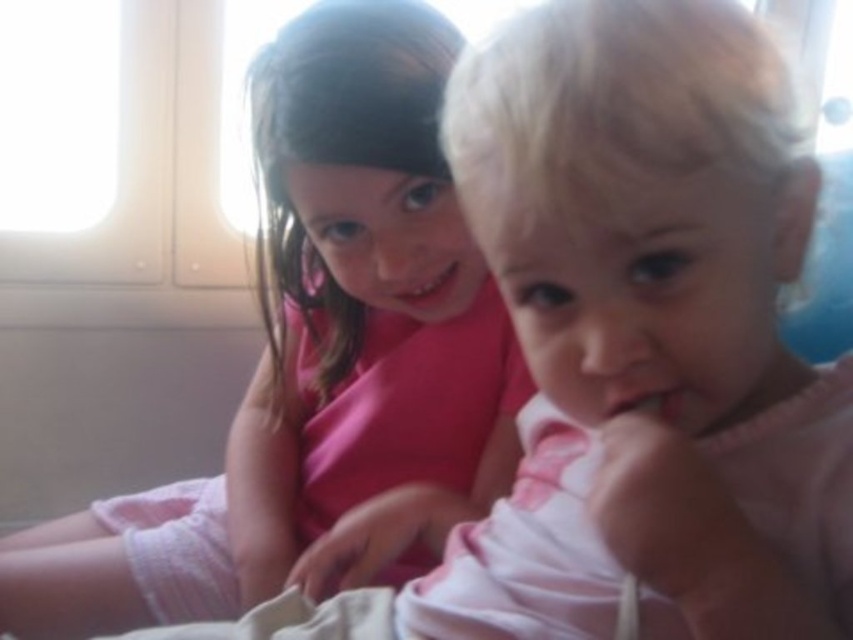
You are a photographer trying to capture a closeup of both children in the image. You have two points marked as reference points for focus. The first point is at coordinates point (x=369, y=26) and the second is at point (x=680, y=388). Which point should you focus on to ensure the child closer to you is in focus?

Point (x=369, y=26) is further to the viewer than point (x=680, y=388), so focusing on point (x=369, y=26) will ensure the child closer to you is in focus.

You are a photographer trying to capture the two children in the scene. You notice both have a matte pink mouth at center and a pink matte mouth at center. Which of the two mouths is directly above the other?

The matte pink mouth at center is positioned over the pink matte mouth at center, meaning it is directly above the latter.

You are a photographer trying to capture a closeup of the pink matte mouth at center without including the pink matte shirt at upper left in the frame. Based on their sizes, is this feasible?

The pink matte shirt at upper left might be wider than pink matte mouth at center, so there is a possibility that the shirt could be in the frame if not positioned carefully. Adjust the angle to ensure only the mouth is visible.